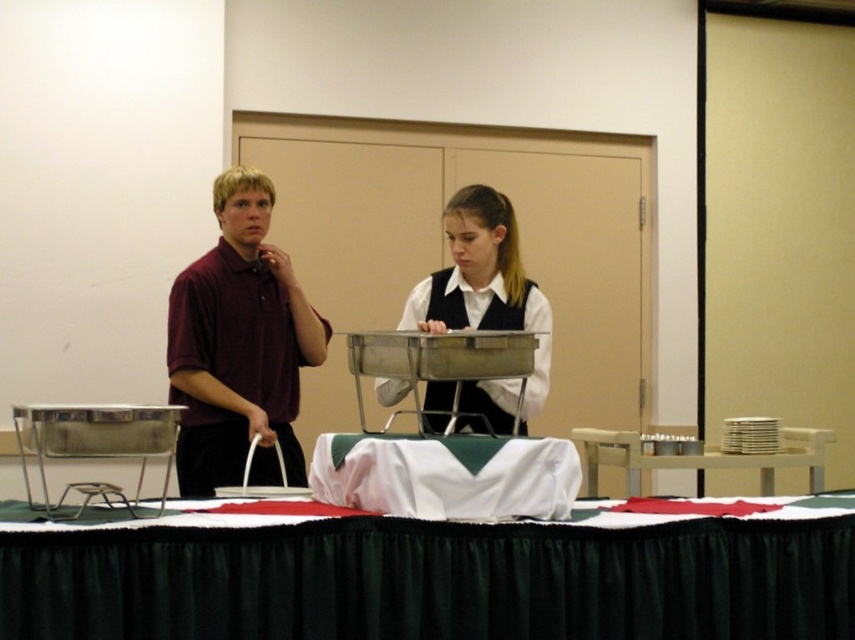
You are at a party and want to place a cake on the table closest to you. Which table should you choose between the black fabric table at lower center and the white wood table at right?

The black fabric table at lower center is above the white wood table at right, so the white wood table at right is farther away. You should choose the black fabric table at lower center as it is closer to you.